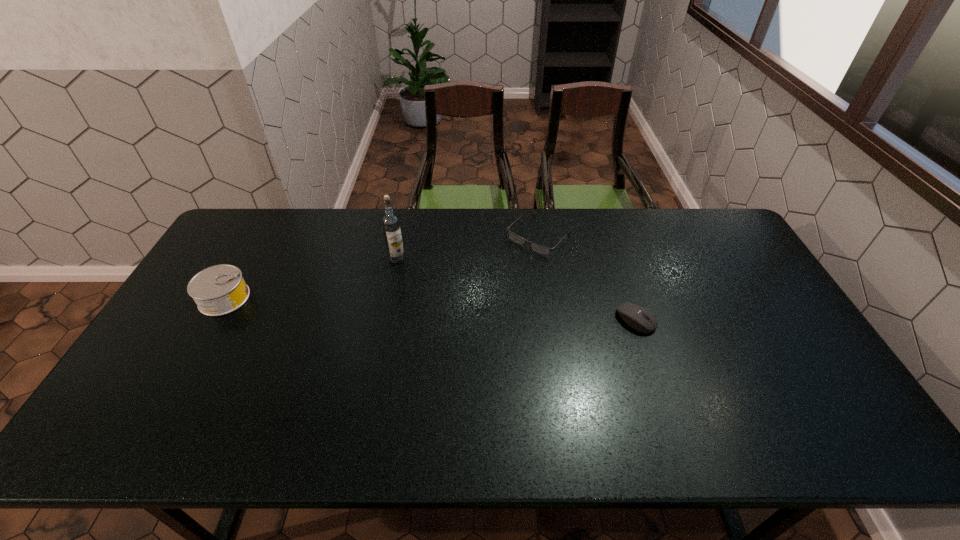
The height and width of the screenshot is (540, 960). Identify the location of free space located 0.190m on the label of the second object from left to right. (369, 305).

This screenshot has height=540, width=960. What are the coordinates of `vacant area situated 0.340m on the front-facing side of the second object from right to left` in the screenshot? It's located at (459, 317).

What are the coordinates of `free location located 0.140m on the front-facing side of the second object from right to left` in the screenshot? It's located at (498, 278).

The height and width of the screenshot is (540, 960). I want to click on vacant space located 0.180m on the front-facing side of the second object from right to left, so click(491, 285).

The image size is (960, 540). Find the location of `object that is at the far edge`. object that is at the far edge is located at coordinates (538, 248).

I want to click on object that is at the left edge, so click(218, 290).

You are a GUI agent. You are given a task and a screenshot of the screen. Output one action in this format:
    pyautogui.click(x=<x>, y=<y>)
    Task: Click on the vacant space at the far edge
    
    Given the screenshot: What is the action you would take?
    pyautogui.click(x=572, y=218)

At what (x,y) coordinates should I click in order to perform the action: click on vacant space at the near edge of the desktop. Please return your answer as a coordinate pair (x, y). Looking at the image, I should click on (669, 396).

I want to click on free region at the right edge of the desktop, so click(x=722, y=266).

Find the location of a particular element. The width and height of the screenshot is (960, 540). vacant space at the far left corner is located at coordinates (240, 220).